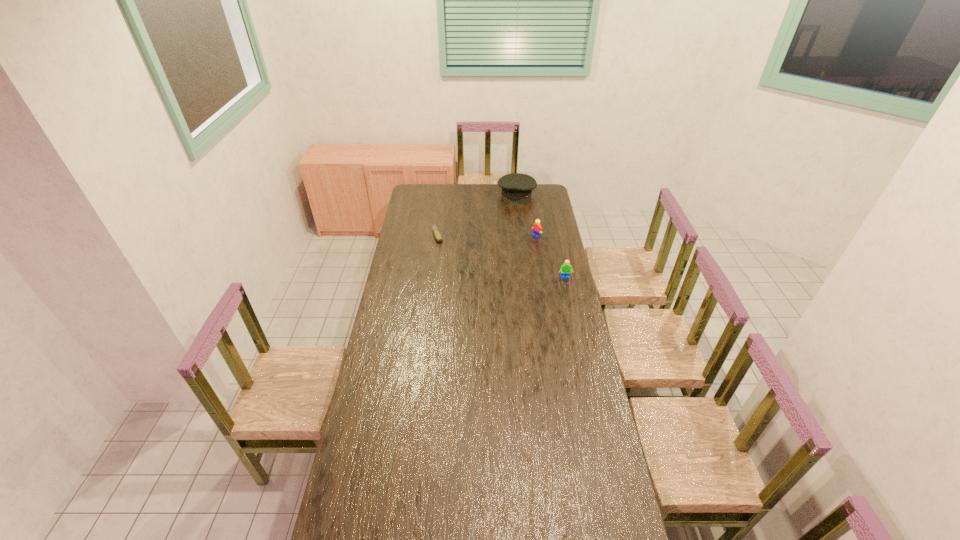
Identify the location of free spot on the desktop that is between the leftmost object and the nearest object and is positioned on the front-facing side of the farthest object. This screenshot has height=540, width=960. point(503,257).

At what (x,y) coordinates should I click in order to perform the action: click on free space on the desktop that is between the shortest object and the nearest object and is positioned on the front-facing side of the left Lego. Please return your answer as a coordinate pair (x, y). Looking at the image, I should click on (504, 257).